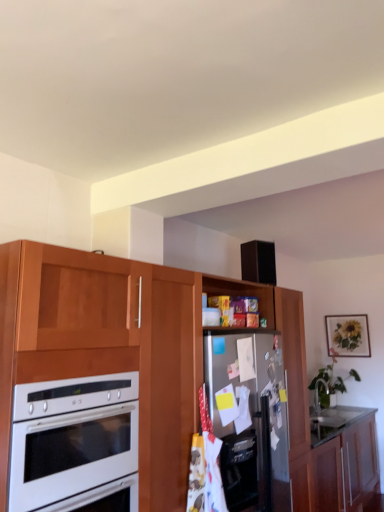
Question: Is white glossy oven at left bigger than wooden cabinet at lower right, the second cabinetry positioned from the top?

Choices:
 (A) no
 (B) yes

Answer: (A)

Question: Is white glossy oven at left in contact with wooden cabinet at lower right, which ranks as the first cabinetry in bottom-to-top order?

Choices:
 (A) no
 (B) yes

Answer: (A)

Question: From the image's perspective, is white glossy oven at left above wooden cabinet at lower right, the second cabinetry positioned from the top?

Choices:
 (A) yes
 (B) no

Answer: (A)

Question: Is white glossy oven at left behind wooden cabinet at lower right, the second cabinetry positioned from the top?

Choices:
 (A) yes
 (B) no

Answer: (B)

Question: From a real-world perspective, does white glossy oven at left sit lower than wooden cabinet at lower right, the second cabinetry positioned from the top?

Choices:
 (A) no
 (B) yes

Answer: (A)

Question: Considering their positions, is wooden cabinet at lower right, the second cabinetry positioned from the top, located in front of or behind matte wooden picture frame at upper right?

Choices:
 (A) behind
 (B) front

Answer: (B)

Question: From the image's perspective, relative to matte wooden picture frame at upper right, is wooden cabinet at lower right, which ranks as the first cabinetry in bottom-to-top order, above or below?

Choices:
 (A) above
 (B) below

Answer: (B)

Question: Looking at the image, does wooden cabinet at lower right, the second cabinetry positioned from the top, seem bigger or smaller compared to matte wooden picture frame at upper right?

Choices:
 (A) small
 (B) big

Answer: (B)

Question: Would you say wooden cabinet at lower right, which ranks as the first cabinetry in bottom-to-top order, is inside or outside matte wooden picture frame at upper right?

Choices:
 (A) inside
 (B) outside

Answer: (B)

Question: Would you say wooden cabinet at lower right, the second cabinetry positioned from the top, is to the left or to the right of wooden cabinet at center, which is the 1th cabinetry from top to bottom, in the picture?

Choices:
 (A) right
 (B) left

Answer: (A)

Question: Is wooden cabinet at lower right, which ranks as the first cabinetry in bottom-to-top order, spatially inside wooden cabinet at center, the 2th cabinetry ordered from the bottom, or outside of it?

Choices:
 (A) outside
 (B) inside

Answer: (B)

Question: Considering the positions of wooden cabinet at lower right, which ranks as the first cabinetry in bottom-to-top order, and wooden cabinet at center, which is the 1th cabinetry from top to bottom, in the image, is wooden cabinet at lower right, which ranks as the first cabinetry in bottom-to-top order, wider or thinner than wooden cabinet at center, which is the 1th cabinetry from top to bottom,?

Choices:
 (A) thin
 (B) wide

Answer: (A)

Question: Is wooden cabinet at lower right, which ranks as the first cabinetry in bottom-to-top order, bigger or smaller than wooden cabinet at center, the 2th cabinetry ordered from the bottom?

Choices:
 (A) small
 (B) big

Answer: (A)

Question: Is point (349, 314) positioned closer to the camera than point (347, 506)?

Choices:
 (A) closer
 (B) farther

Answer: (B)

Question: Would you say matte wooden picture frame at upper right is inside or outside wooden cabinet at lower right, which ranks as the first cabinetry in bottom-to-top order?

Choices:
 (A) outside
 (B) inside

Answer: (A)